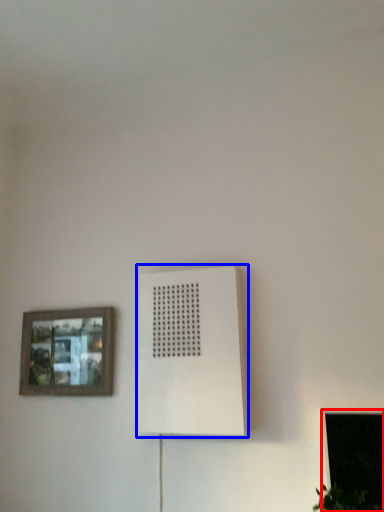
Question: Which point is closer to the camera, window (highlighted by a red box) or air conditioning (highlighted by a blue box)?

Choices:
 (A) window
 (B) air conditioning

Answer: (A)